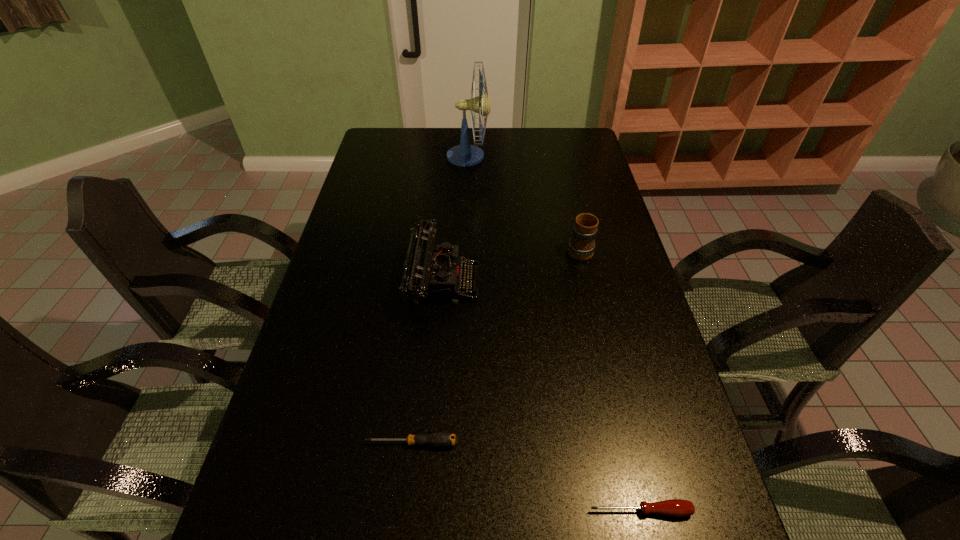
Identify the location of the second closest object to the tallest object. (581, 246).

Where is `object that is the closest to the left screwdriver`? This screenshot has height=540, width=960. object that is the closest to the left screwdriver is located at coordinates point(674,507).

Identify the location of free space that satisfies the following two spatial constraints: 1. on the keyboard of the typewriter; 2. on the back side of the right screwdriver. (424, 511).

You are a GUI agent. You are given a task and a screenshot of the screen. Output one action in this format:
    pyautogui.click(x=<x>, y=<y>)
    Task: Click on the free space that satisfies the following two spatial constraints: 1. on the side of the mug with the handle; 2. at the front of the tallest object where the blades are visible
    This screenshot has width=960, height=540.
    Given the screenshot: What is the action you would take?
    pyautogui.click(x=558, y=157)

The image size is (960, 540). I want to click on blank area in the image that satisfies the following two spatial constraints: 1. on the side of the mug with the handle; 2. at the front of the fan where the blades are visible, so click(x=558, y=157).

Image resolution: width=960 pixels, height=540 pixels. I want to click on free point that satisfies the following two spatial constraints: 1. at the front of the farthest object where the blades are visible; 2. on the side of the mug with the handle, so click(465, 248).